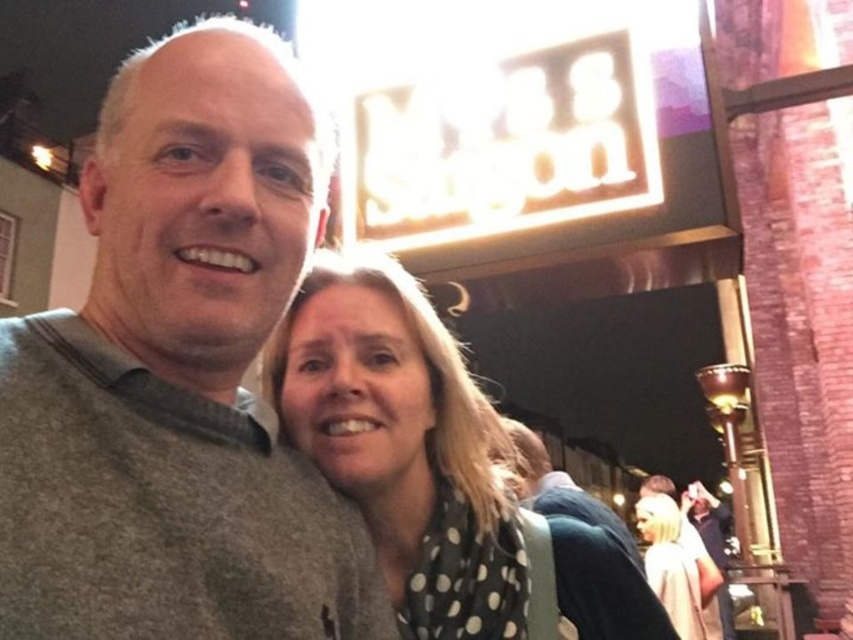
Question: Which of the following is the farthest from the observer?

Choices:
 (A) black dotted scarf at center
 (B) dark gray sweater at center

Answer: (B)

Question: From the image, what is the correct spatial relationship of gray sweater at left in relation to white dotted scarf at lower right?

Choices:
 (A) above
 (B) below

Answer: (A)

Question: Estimate the real-world distances between objects in this image. Which object is closer to the white dotted scarf at lower right?

Choices:
 (A) gray sweater at left
 (B) dark gray sweater at center
 (C) black dotted scarf at center

Answer: (B)

Question: Considering the relative positions of black dotted scarf at center and dark gray sweater at center in the image provided, where is black dotted scarf at center located with respect to dark gray sweater at center?

Choices:
 (A) below
 (B) above

Answer: (B)

Question: Among these points, which one is nearest to the camera?

Choices:
 (A) (299, 161)
 (B) (643, 552)
 (C) (590, 499)

Answer: (A)

Question: Where is gray sweater at left located in relation to black dotted scarf at center in the image?

Choices:
 (A) left
 (B) right

Answer: (A)